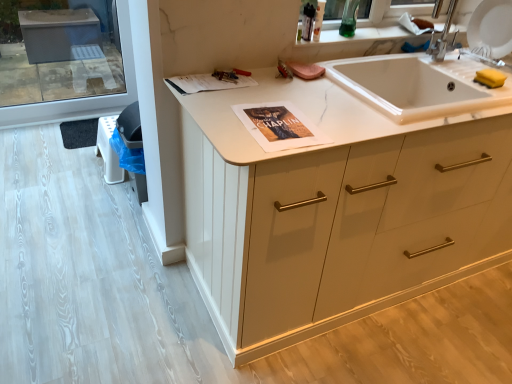
I want to click on vacant space in matte paper magazine at upper center (from a real-world perspective), so click(x=202, y=80).